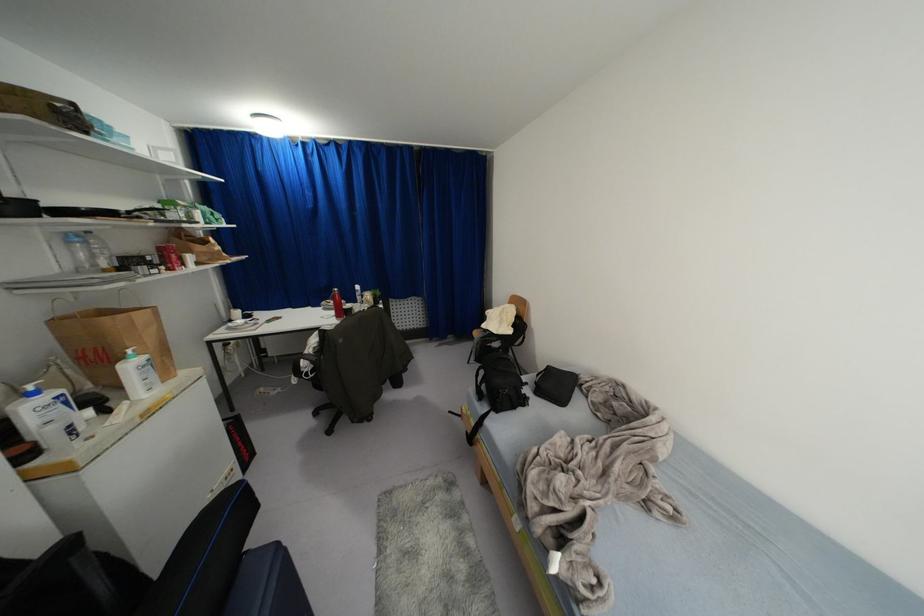
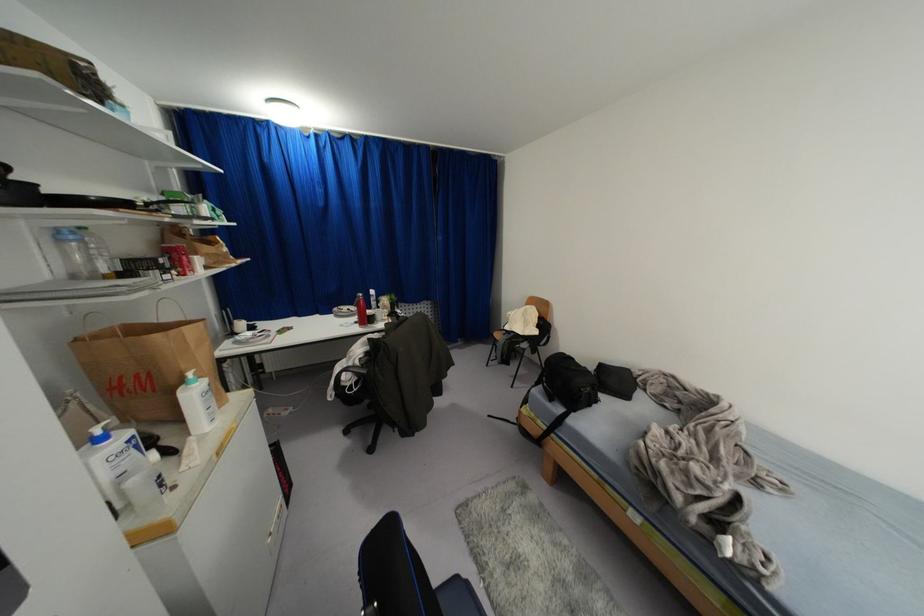
Question: The camera is either moving clockwise (left) or counter-clockwise (right) around the object. The first image is from the beginning of the video and the second image is from the end. Is the camera moving left or right when shooting the video?

Choices:
 (A) Left
 (B) Right

Answer: (A)